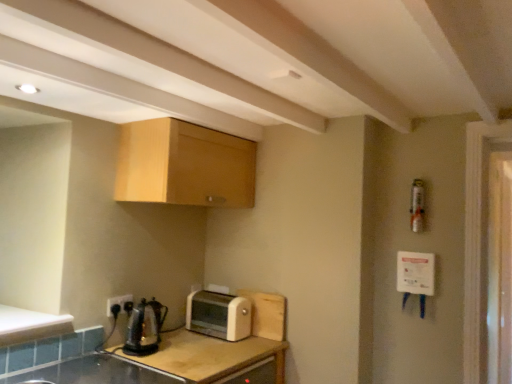
Question: Is transparent glass screen door at right thinner than beige plastic toaster at center?

Choices:
 (A) yes
 (B) no

Answer: (A)

Question: Considering the relative positions of transparent glass screen door at right and beige plastic toaster at center in the image provided, is transparent glass screen door at right to the left of beige plastic toaster at center from the viewer's perspective?

Choices:
 (A) yes
 (B) no

Answer: (B)

Question: Is beige plastic toaster at center located within transparent glass screen door at right?

Choices:
 (A) no
 (B) yes

Answer: (A)

Question: Is the position of transparent glass screen door at right less distant than that of beige plastic toaster at center?

Choices:
 (A) yes
 (B) no

Answer: (B)

Question: Is transparent glass screen door at right oriented towards beige plastic toaster at center?

Choices:
 (A) yes
 (B) no

Answer: (B)

Question: Is beige plastic toaster at center wider or thinner than white matte counter top at lower left?

Choices:
 (A) wide
 (B) thin

Answer: (B)

Question: Is beige plastic toaster at center spatially inside white matte counter top at lower left, or outside of it?

Choices:
 (A) inside
 (B) outside

Answer: (B)

Question: Is point (242, 304) closer or farther from the camera than point (38, 332)?

Choices:
 (A) farther
 (B) closer

Answer: (A)

Question: Considering the positions of beige plastic toaster at center and white matte counter top at lower left in the image, is beige plastic toaster at center bigger or smaller than white matte counter top at lower left?

Choices:
 (A) big
 (B) small

Answer: (A)

Question: Does point (16, 334) appear closer or farther from the camera than point (110, 359)?

Choices:
 (A) closer
 (B) farther

Answer: (A)

Question: In the image, is white matte counter top at lower left positioned in front of or behind wooden at lower left?

Choices:
 (A) behind
 (B) front

Answer: (B)

Question: From a real-world perspective, is white matte counter top at lower left above or below wooden at lower left?

Choices:
 (A) below
 (B) above

Answer: (B)

Question: Is white matte counter top at lower left wider or thinner than wooden at lower left?

Choices:
 (A) thin
 (B) wide

Answer: (A)

Question: From the image's perspective, is white matte counter top at lower left above or below shiny metallic kettle at lower left?

Choices:
 (A) below
 (B) above

Answer: (B)

Question: Considering the positions of white matte counter top at lower left and shiny metallic kettle at lower left in the image, is white matte counter top at lower left wider or thinner than shiny metallic kettle at lower left?

Choices:
 (A) wide
 (B) thin

Answer: (A)